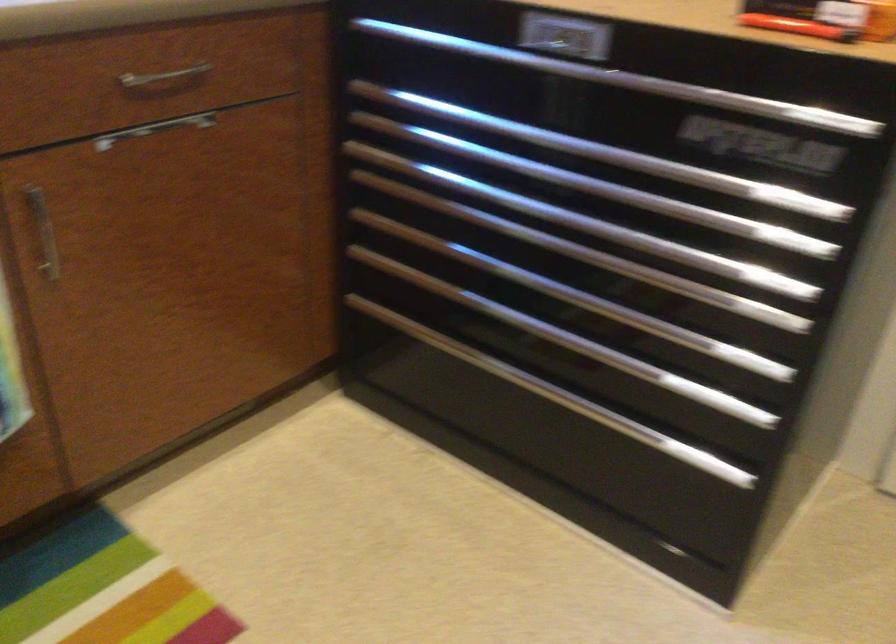
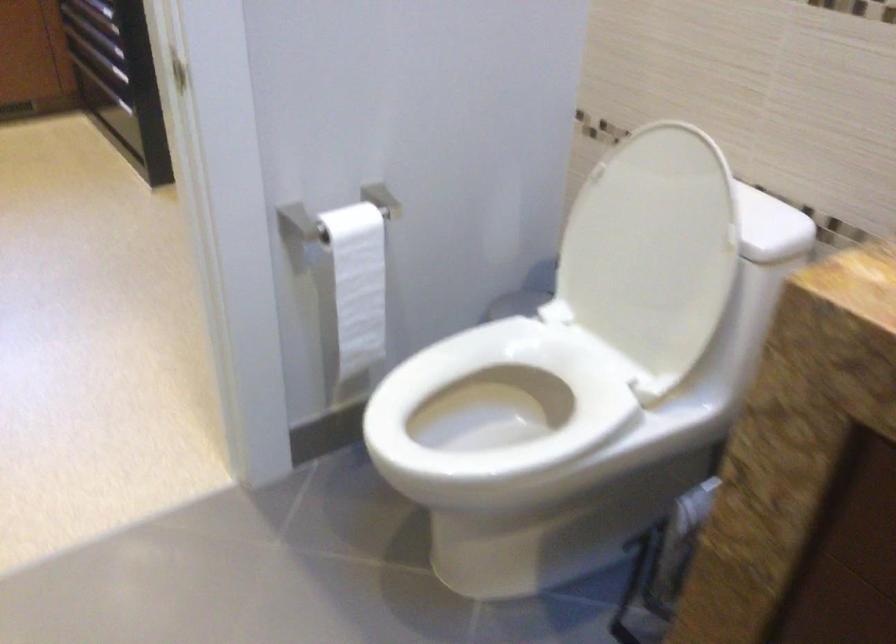
In a continuous first-person perspective shot, in which direction is the camera moving?

The cameraman moved toward right, backward.